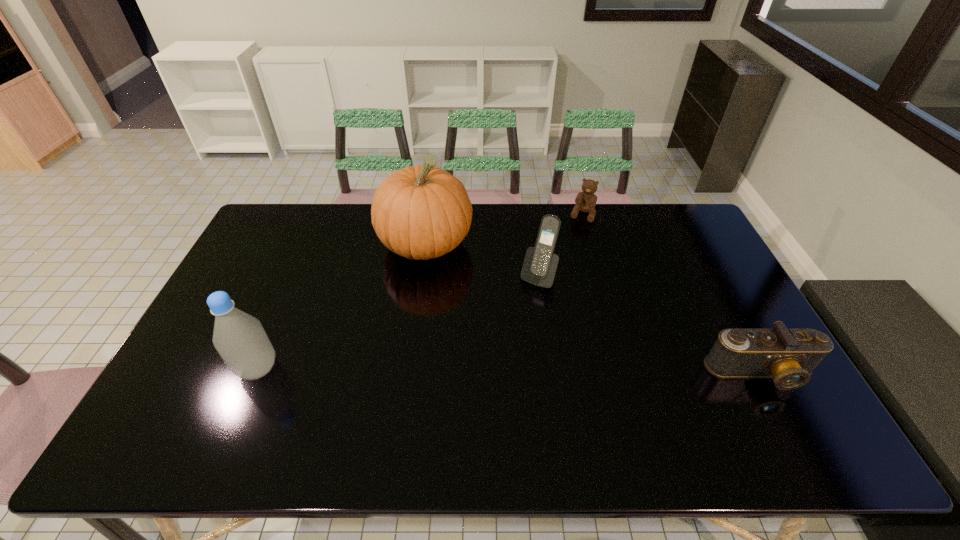
I want to click on vacant spot on the desktop that is between the leftmost object and the camera and is positioned on the stem of the second object from left to right, so click(520, 371).

You are a GUI agent. You are given a task and a screenshot of the screen. Output one action in this format:
    pyautogui.click(x=<x>, y=<y>)
    Task: Click on the free space on the desktop that is between the bottle and the camera and is positioned on the front-facing side of the third object from right to left
    This screenshot has height=540, width=960.
    Given the screenshot: What is the action you would take?
    pyautogui.click(x=483, y=370)

The width and height of the screenshot is (960, 540). Find the location of `free space on the desktop that is between the fourth shortest object and the camera and is positioned on the face of the second object from right to left`. free space on the desktop that is between the fourth shortest object and the camera and is positioned on the face of the second object from right to left is located at coordinates (518, 371).